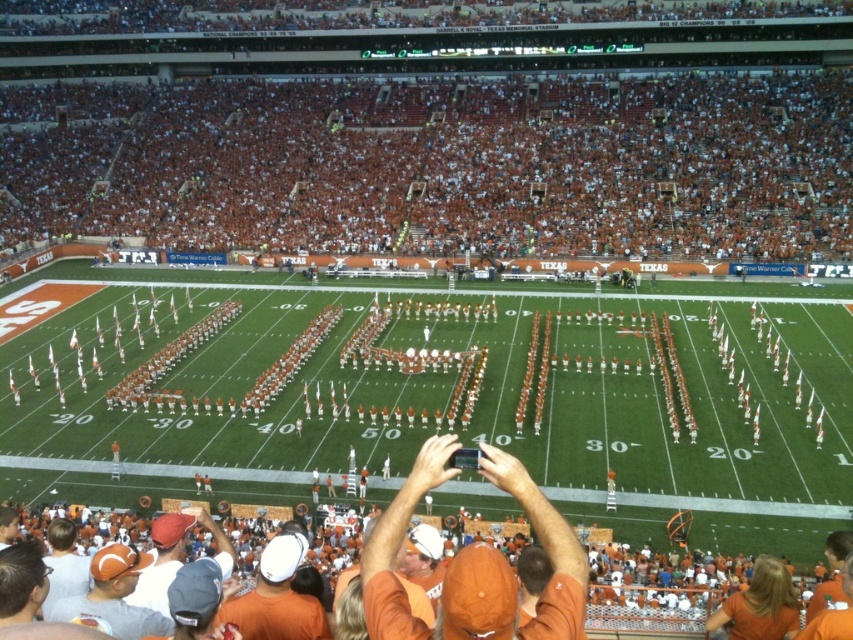
Between orange cotton shirt at center and orange cotton shirt at lower left, which one appears on the left side from the viewer's perspective?

orange cotton shirt at lower left

Is orange cotton shirt at center to the right of orange cotton shirt at lower left from the viewer's perspective?

Yes, orange cotton shirt at center is to the right of orange cotton shirt at lower left.

Is point (373, 529) positioned after point (144, 609)?

No, it is in front of (144, 609).

The height and width of the screenshot is (640, 853). What are the coordinates of `orange cotton shirt at center` in the screenshot? It's located at (512, 572).